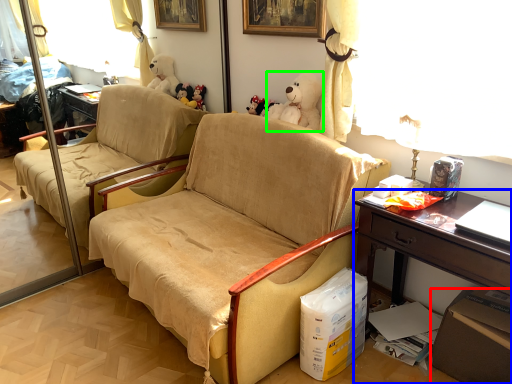
Question: Based on their relative distances, which object is nearer to box (highlighted by a red box)? Choose from desk (highlighted by a blue box) and toy (highlighted by a green box).

Choices:
 (A) desk
 (B) toy

Answer: (A)